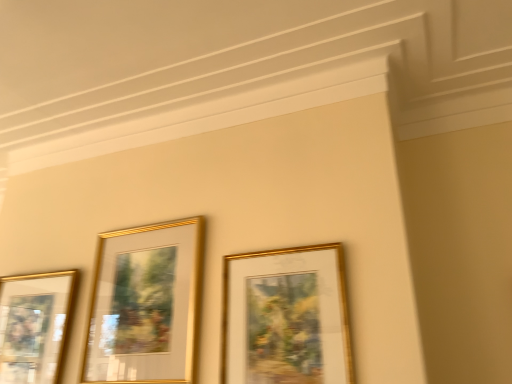
Question: From the image's perspective, is gold metallic picture frame at left, which ranks as the 1th picture frame in left-to-right order, located beneath gold/glossy picture frame at center, acting as the third picture frame starting from the left?

Choices:
 (A) no
 (B) yes

Answer: (B)

Question: Is gold metallic picture frame at left, arranged as the third picture frame when viewed from the right, outside gold/glossy picture frame at center, acting as the third picture frame starting from the left?

Choices:
 (A) yes
 (B) no

Answer: (A)

Question: Is gold metallic picture frame at left, which ranks as the 1th picture frame in left-to-right order, far away from gold/glossy picture frame at center, the first picture frame in the right-to-left sequence?

Choices:
 (A) no
 (B) yes

Answer: (A)

Question: Does gold metallic picture frame at left, which ranks as the 1th picture frame in left-to-right order, have a greater height compared to gold/glossy picture frame at center, acting as the third picture frame starting from the left?

Choices:
 (A) yes
 (B) no

Answer: (A)

Question: From the image's perspective, is gold metallic picture frame at left, arranged as the third picture frame when viewed from the right, on gold/glossy picture frame at center, the first picture frame in the right-to-left sequence?

Choices:
 (A) no
 (B) yes

Answer: (A)

Question: From the image's perspective, is gold metallic picture frame at left, arranged as the third picture frame when viewed from the right, above or below gold/glossy picture frame at center, which is the 2th picture frame from right to left?

Choices:
 (A) above
 (B) below

Answer: (B)

Question: Considering the positions of gold metallic picture frame at left, arranged as the third picture frame when viewed from the right, and gold/glossy picture frame at center, the 2th picture frame viewed from the left, in the image, is gold metallic picture frame at left, arranged as the third picture frame when viewed from the right, bigger or smaller than gold/glossy picture frame at center, the 2th picture frame viewed from the left,?

Choices:
 (A) small
 (B) big

Answer: (B)

Question: Is point (52, 380) positioned closer to the camera than point (139, 339)?

Choices:
 (A) closer
 (B) farther

Answer: (B)

Question: Relative to gold/glossy picture frame at center, which is the 2th picture frame from right to left, is gold metallic picture frame at left, arranged as the third picture frame when viewed from the right, in front or behind?

Choices:
 (A) behind
 (B) front

Answer: (A)

Question: Looking at the image, does gold/glossy picture frame at center, the first picture frame in the right-to-left sequence, seem bigger or smaller compared to gold/glossy picture frame at center, which is the 2th picture frame from right to left?

Choices:
 (A) big
 (B) small

Answer: (B)

Question: Considering the positions of gold/glossy picture frame at center, acting as the third picture frame starting from the left, and gold/glossy picture frame at center, which is the 2th picture frame from right to left, in the image, is gold/glossy picture frame at center, acting as the third picture frame starting from the left, taller or shorter than gold/glossy picture frame at center, which is the 2th picture frame from right to left,?

Choices:
 (A) short
 (B) tall

Answer: (A)

Question: Looking at their shapes, would you say gold/glossy picture frame at center, acting as the third picture frame starting from the left, is wider or thinner than gold/glossy picture frame at center, the 2th picture frame viewed from the left?

Choices:
 (A) thin
 (B) wide

Answer: (A)

Question: From the image's perspective, is gold/glossy picture frame at center, acting as the third picture frame starting from the left, positioned above or below gold/glossy picture frame at center, which is the 2th picture frame from right to left?

Choices:
 (A) below
 (B) above

Answer: (B)

Question: Is gold/glossy picture frame at center, acting as the third picture frame starting from the left, bigger or smaller than gold metallic picture frame at left, which ranks as the 1th picture frame in left-to-right order?

Choices:
 (A) big
 (B) small

Answer: (B)

Question: Is gold/glossy picture frame at center, the first picture frame in the right-to-left sequence, wider or thinner than gold metallic picture frame at left, arranged as the third picture frame when viewed from the right?

Choices:
 (A) wide
 (B) thin

Answer: (B)